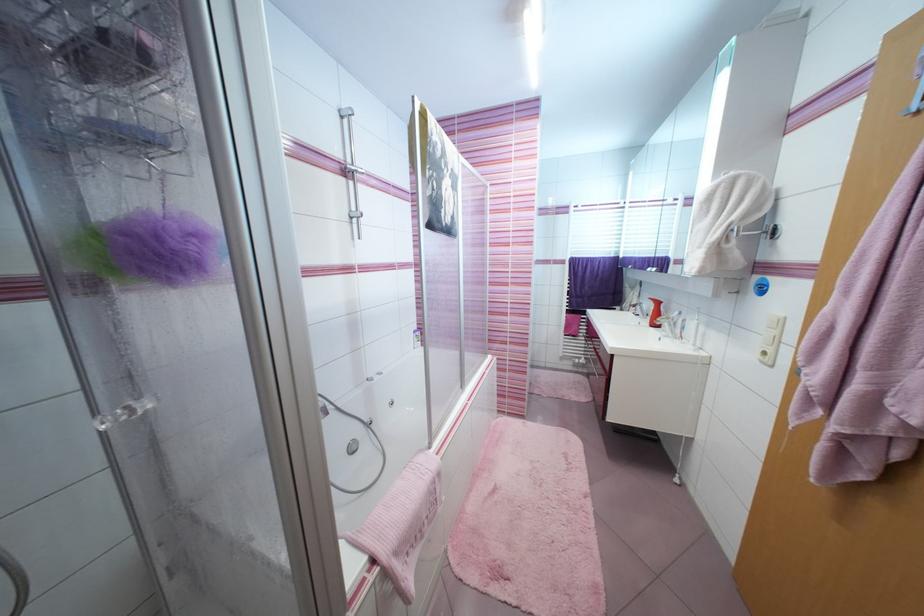
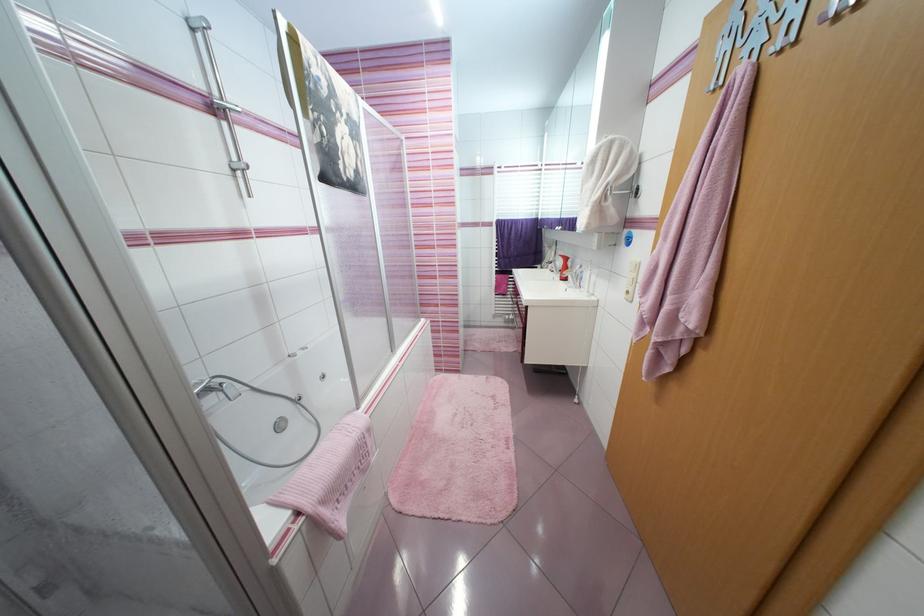
Locate, in the second image, the point that corresponds to (x=650, y=307) in the first image.

(563, 264)